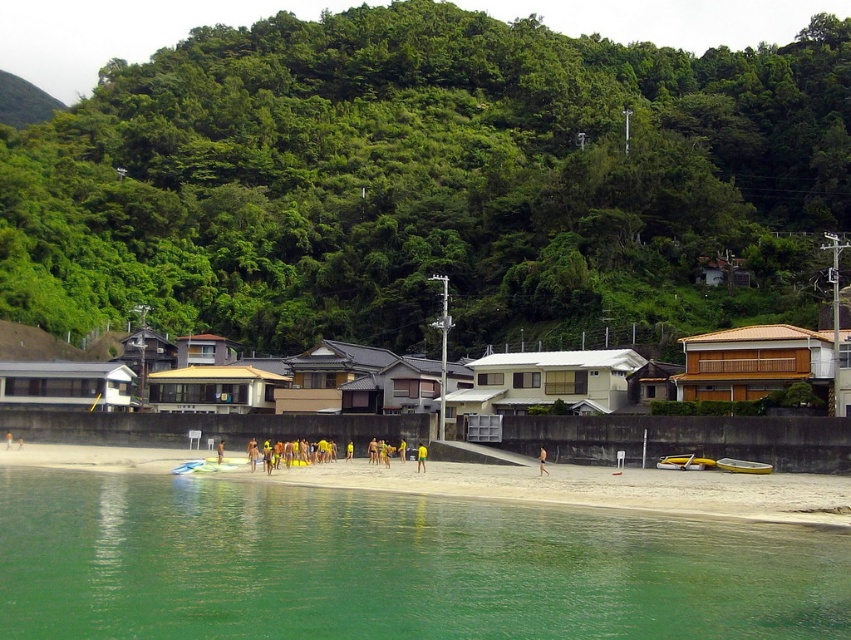
Question: Which of the following is the closest to the observer?

Choices:
 (A) yellow plastic boat at lower right
 (B) tan skin person at center

Answer: (B)

Question: Does white sand beach at lower center appear on the right side of yellow fabric person at center?

Choices:
 (A) yes
 (B) no

Answer: (B)

Question: Which point appears closest to the camera in this image?

Choices:
 (A) (741, 465)
 (B) (586, 596)
 (C) (426, 451)

Answer: (B)

Question: Can you confirm if yellow plastic boat at lower right is positioned below tan skin person at center?

Choices:
 (A) yes
 (B) no

Answer: (B)

Question: Does green translucent water at lower left appear under yellow fabric person at center?

Choices:
 (A) no
 (B) yes

Answer: (A)

Question: Which of the following is the farthest from the observer?

Choices:
 (A) (301, 561)
 (B) (421, 468)
 (C) (747, 468)

Answer: (B)